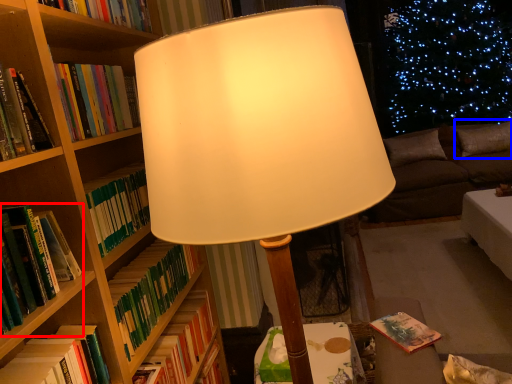
Question: Which object appears farthest to the camera in this image, book (highlighted by a red box) or pillow (highlighted by a blue box)?

Choices:
 (A) book
 (B) pillow

Answer: (B)